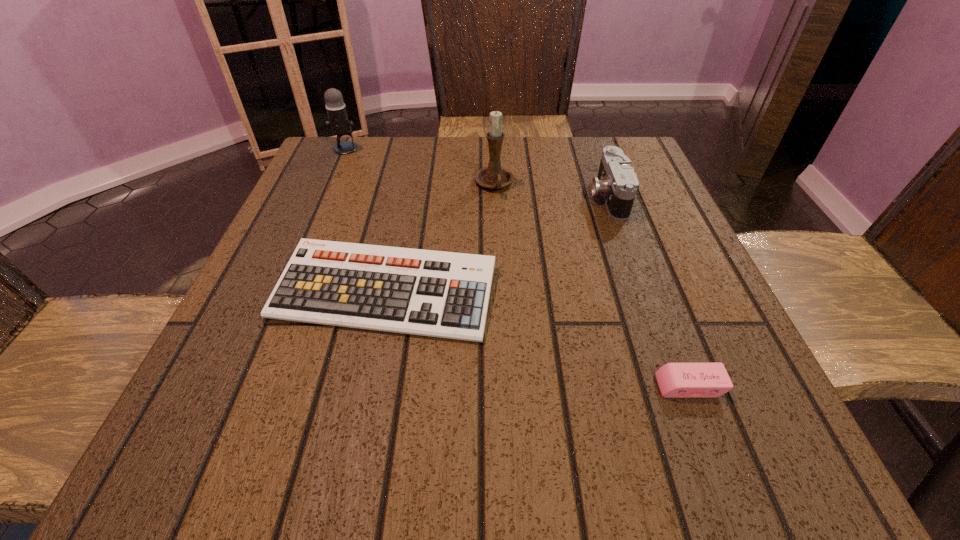
The height and width of the screenshot is (540, 960). I want to click on vacant space located 0.250m on the right of the second nearest object, so [643, 292].

Where is `blank space located 0.320m on the back of the eraser`? This screenshot has height=540, width=960. blank space located 0.320m on the back of the eraser is located at coordinates (631, 232).

Find the location of `candle holder located at the far edge`. candle holder located at the far edge is located at coordinates (494, 176).

This screenshot has height=540, width=960. Identify the location of microphone located at the far edge. (338, 121).

What are the coordinates of `camera that is at the far edge` in the screenshot? It's located at (616, 180).

Locate an element on the screen. microphone situated at the left edge is located at coordinates (338, 121).

Where is `computer keyboard at the left edge`? computer keyboard at the left edge is located at coordinates (441, 294).

At what (x,y) coordinates should I click in order to perform the action: click on camera that is positioned at the right edge. Please return your answer as a coordinate pair (x, y). Image resolution: width=960 pixels, height=540 pixels. Looking at the image, I should click on (616, 180).

At what (x,y) coordinates should I click in order to perform the action: click on eraser at the right edge. Please return your answer as a coordinate pair (x, y). Looking at the image, I should click on (675, 380).

Where is `object positioned at the far left corner`? Image resolution: width=960 pixels, height=540 pixels. object positioned at the far left corner is located at coordinates (338, 121).